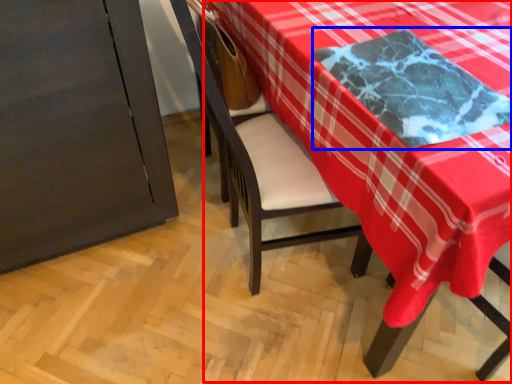
Question: Which point is further to the camera, table (highlighted by a red box) or cloth (highlighted by a blue box)?

Choices:
 (A) table
 (B) cloth

Answer: (A)